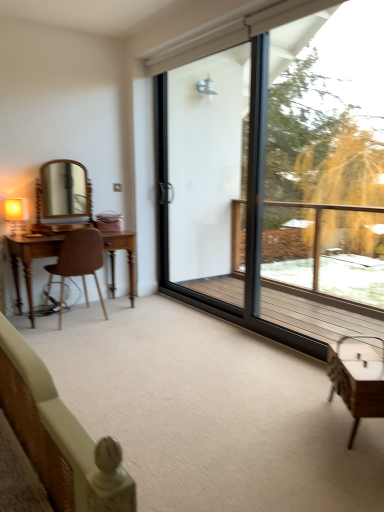
Question: Considering their positions, is transparent glass screen door at center located in front of or behind matte gold table lamp at left?

Choices:
 (A) behind
 (B) front

Answer: (B)

Question: Based on their sizes in the image, would you say transparent glass screen door at center is bigger or smaller than matte gold table lamp at left?

Choices:
 (A) big
 (B) small

Answer: (A)

Question: Considering the real-world distances, which object is farthest from the wooden desk at left, the first table in the back-to-front sequence?

Choices:
 (A) transparent glass screen door at center
 (B) white glossy table at lower right, arranged as the second table when viewed from the left
 (C) brown leather chair at left
 (D) transparent glass window at center
 (E) matte gold table lamp at left

Answer: (D)

Question: Which is farther from the transparent glass window at center?

Choices:
 (A) brown leather chair at left
 (B) wooden desk at left, the first table in the back-to-front sequence
 (C) green leafy tree at right
 (D) white glossy table at lower right, which is the 1th table from right to left
 (E) transparent glass screen door at center

Answer: (B)